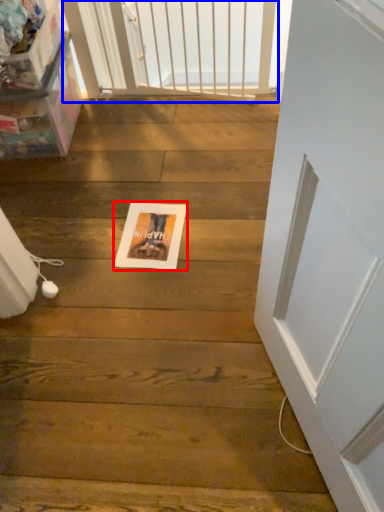
Question: Which of the following is the closest to the observer, postcard (highlighted by a red box) or screen door (highlighted by a blue box)?

Choices:
 (A) postcard
 (B) screen door

Answer: (A)